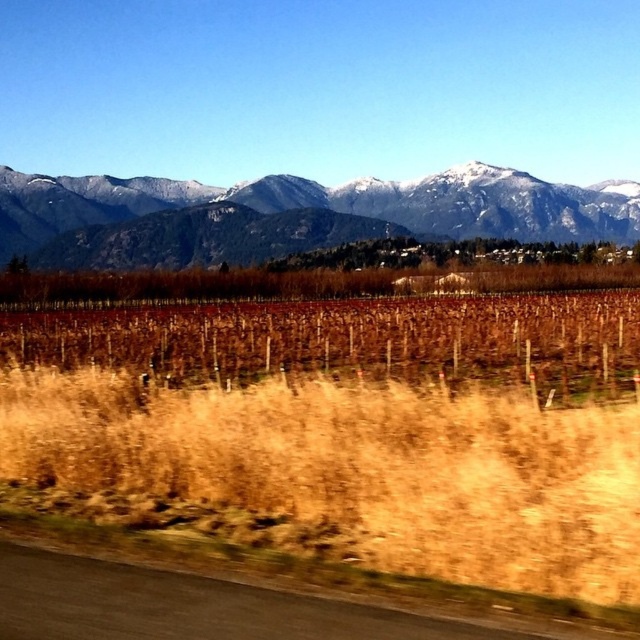
You are standing at the black asphalt road at lower left and want to take a photo of the snowy rocky mountains at upper center. In which direction should you point your camera?

You should point your camera to the right because the snowy rocky mountains at upper center is to the right of the black asphalt road at lower left.

You are standing in the middle of a vineyard and see the dry grass at lower center and the snowy rocky mountains at upper center. Which object is closer to you?

The dry grass at lower center is closer to you because it is positioned under the snowy rocky mountains at upper center, which are further away.

You are standing at the lower center of the image and see the point marked at coordinates (356,424). What type of terrain feature is located at that point?

The point at coordinates (356,424) corresponds to dry grass at lower center.